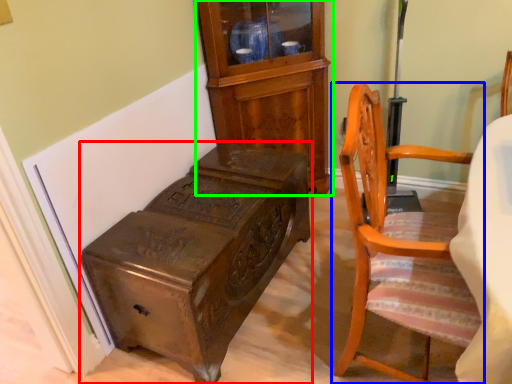
Question: Estimate the real-world distances between objects in this image. Which object is farther from furniture (highlighted by a red box), chair (highlighted by a blue box) or cabinetry (highlighted by a green box)?

Choices:
 (A) chair
 (B) cabinetry

Answer: (B)